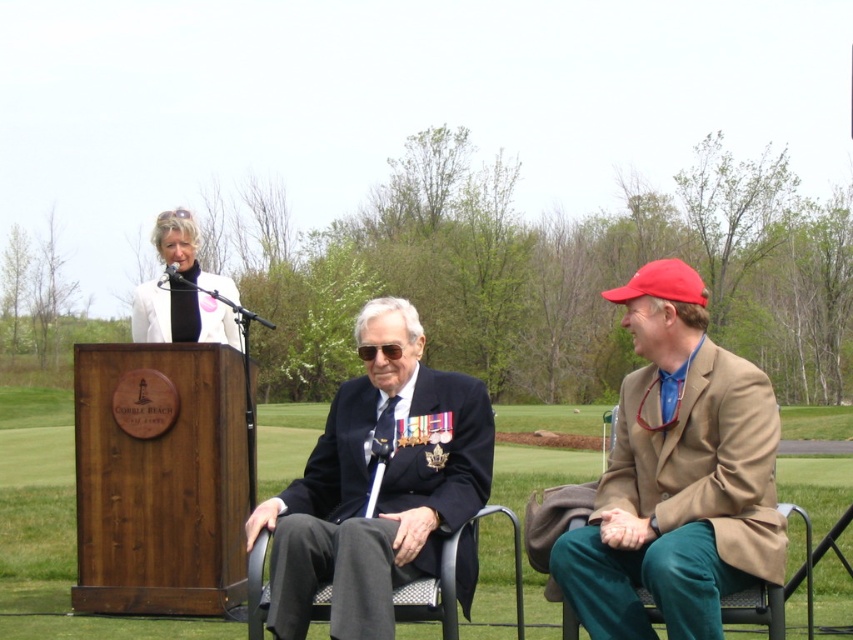
Question: Is tan fabric blazer at right positioned at the back of white fabric uniform at upper center?

Choices:
 (A) yes
 (B) no

Answer: (B)

Question: Where is tan fabric blazer at right located in relation to green grass at center in the image?

Choices:
 (A) below
 (B) above

Answer: (B)

Question: Which of the following is the closest to the observer?

Choices:
 (A) (331, 461)
 (B) (618, 500)
 (C) (189, 296)

Answer: (B)

Question: Which of these objects is positioned farthest from the green grass at center?

Choices:
 (A) white fabric uniform at upper center
 (B) navy blue fabric uniform at center

Answer: (A)

Question: From the image, what is the correct spatial relationship of green grass at center in relation to white fabric uniform at upper center?

Choices:
 (A) right
 (B) left

Answer: (A)

Question: Estimate the real-world distances between objects in this image. Which object is closer to the white fabric uniform at upper center?

Choices:
 (A) green grass at center
 (B) navy blue fabric uniform at center
 (C) tan fabric blazer at right

Answer: (B)